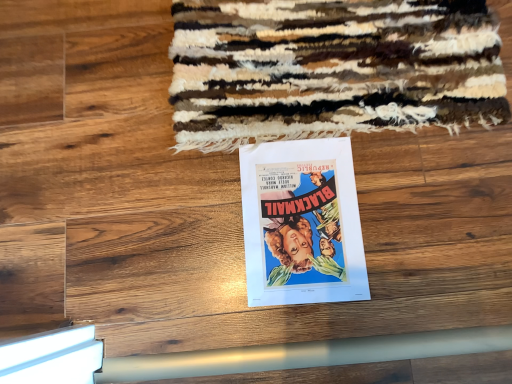
The image size is (512, 384). What are the coordinates of `free spot to the left of matte paper poster at center` in the screenshot? It's located at (179, 226).